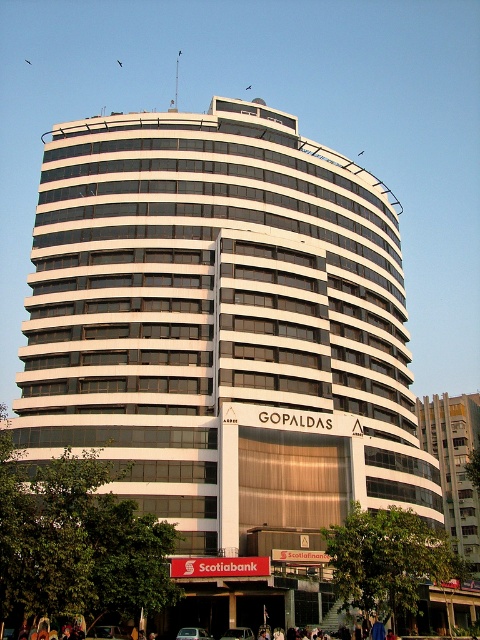
Who is shorter, silver metallic sedan at center or green matte car at center?

Standing shorter between the two is green matte car at center.

Is the position of silver metallic sedan at center less distant than that of green matte car at center?

Yes, silver metallic sedan at center is closer to the viewer.

Is point (180, 628) positioned before point (250, 632)?

No.

Image resolution: width=480 pixels, height=640 pixels. I want to click on silver metallic sedan at center, so click(192, 634).